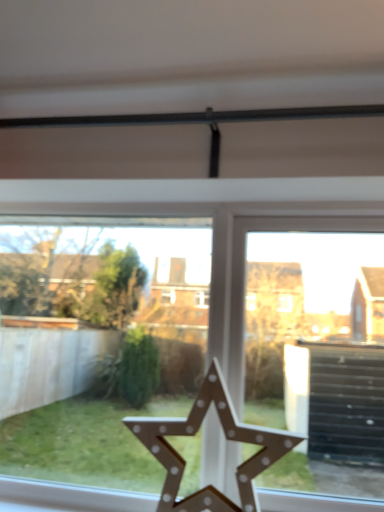
Question: From a real-world perspective, does wooden star at center stand above wooden star at center?

Choices:
 (A) yes
 (B) no

Answer: (B)

Question: Would you say wooden star at center is outside wooden star at center?

Choices:
 (A) yes
 (B) no

Answer: (A)

Question: From a real-world perspective, is wooden star at center located beneath wooden star at center?

Choices:
 (A) no
 (B) yes

Answer: (B)

Question: Is wooden star at center positioned with its back to wooden star at center?

Choices:
 (A) no
 (B) yes

Answer: (B)

Question: Considering the relative sizes of wooden star at center and wooden star at center in the image provided, is wooden star at center wider than wooden star at center?

Choices:
 (A) yes
 (B) no

Answer: (A)

Question: Does wooden star at center appear on the right side of wooden star at center?

Choices:
 (A) yes
 (B) no

Answer: (A)

Question: Can you confirm if wooden star at center is shorter than wooden star at center?

Choices:
 (A) yes
 (B) no

Answer: (B)

Question: Can you confirm if wooden star at center is positioned to the right of wooden star at center?

Choices:
 (A) yes
 (B) no

Answer: (B)

Question: From the image's perspective, is wooden star at center over wooden star at center?

Choices:
 (A) no
 (B) yes

Answer: (B)

Question: Is wooden star at center looking in the opposite direction of wooden star at center?

Choices:
 (A) no
 (B) yes

Answer: (B)

Question: Can you confirm if wooden star at center is taller than wooden star at center?

Choices:
 (A) yes
 (B) no

Answer: (A)

Question: Is wooden star at center at the left side of wooden star at center?

Choices:
 (A) yes
 (B) no

Answer: (A)

Question: Is wooden star at center situated inside wooden star at center or outside?

Choices:
 (A) outside
 (B) inside

Answer: (A)